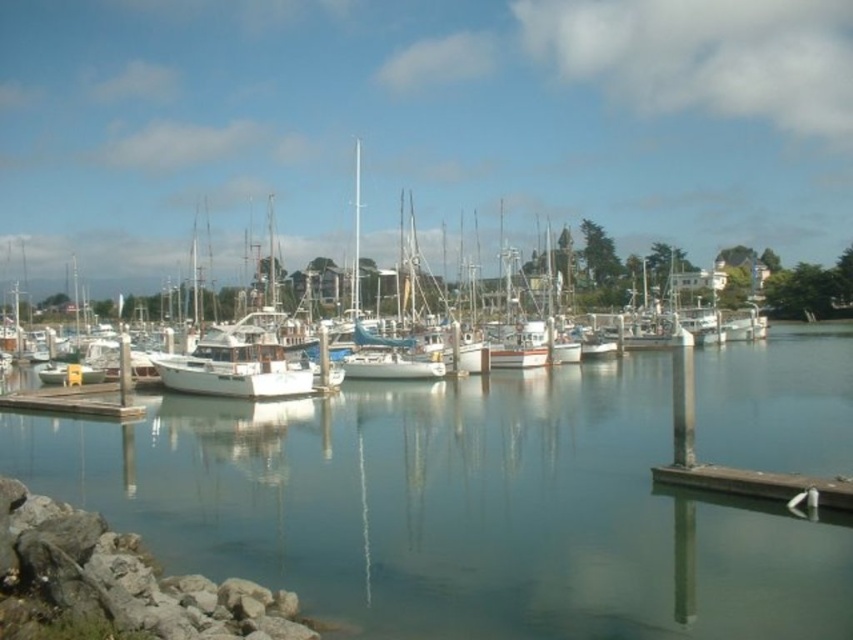
Is smooth wood dock at lower right smaller than wooden dock at lower left?

Correct, smooth wood dock at lower right occupies less space than wooden dock at lower left.

Who is taller, smooth wood dock at lower right or wooden dock at lower left?

wooden dock at lower left is taller.

Is point (672, 486) positioned behind point (74, 404)?

No.

I want to click on smooth wood dock at lower right, so click(759, 484).

Which is above, clear water at center or smooth wood dock at lower right?

Positioned higher is clear water at center.

Who is shorter, clear water at center or smooth wood dock at lower right?

With less height is smooth wood dock at lower right.

What do you see at coordinates (454, 508) in the screenshot?
I see `clear water at center` at bounding box center [454, 508].

Find the location of a particular element. The image size is (853, 640). clear water at center is located at coordinates (454, 508).

Which is more to the right, clear water at center or wooden dock at lower left?

Positioned to the right is clear water at center.

Is clear water at center above wooden dock at lower left?

Indeed, clear water at center is positioned over wooden dock at lower left.

Which is in front, point (515, 384) or point (10, 392)?

Point (10, 392) is more forward.

Where is `clear water at center`? This screenshot has height=640, width=853. clear water at center is located at coordinates (454, 508).